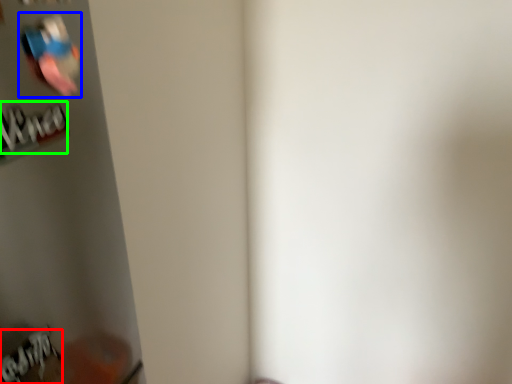
Question: Estimate the real-world distances between objects in this image. Which object is closer to writing (highlighted by a red box), Wii controller (highlighted by a blue box) or writing (highlighted by a green box)?

Choices:
 (A) Wii controller
 (B) writing

Answer: (B)